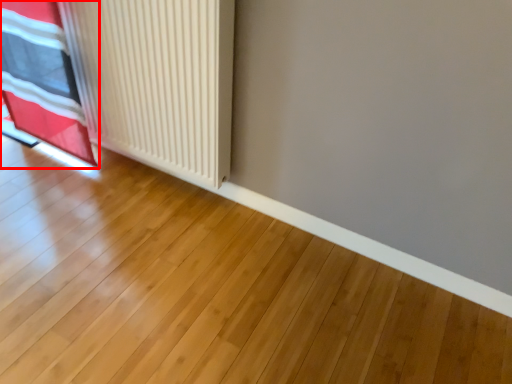
Question: From the image's perspective, where is curtain (annotated by the red box) located in relation to radiator in the image?

Choices:
 (A) above
 (B) below

Answer: (A)